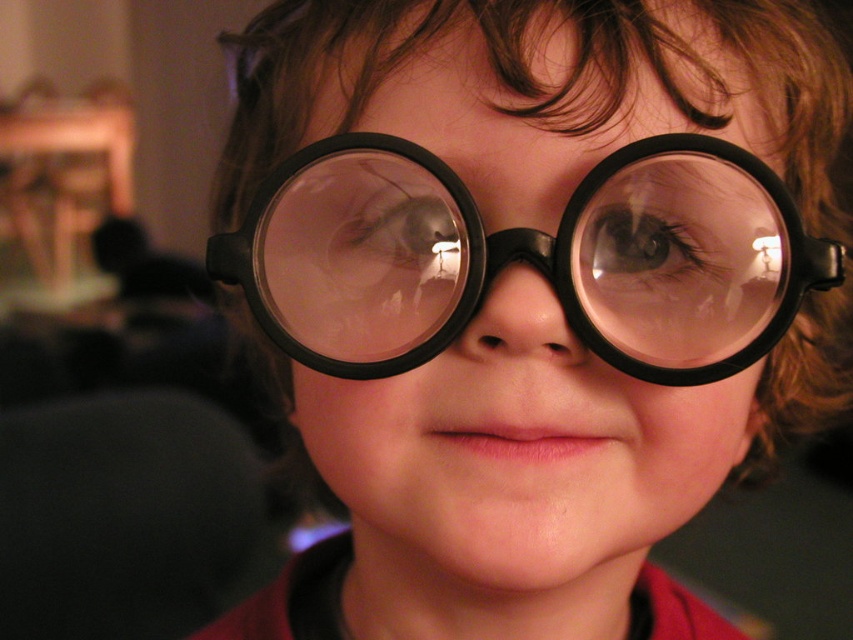
Question: Does black matte goggles at center appear on the right side of brown matte eye at center?

Choices:
 (A) yes
 (B) no

Answer: (B)

Question: Which of the following is the closest to the observer?

Choices:
 (A) [672, 211]
 (B) [335, 276]
 (C) [402, 259]

Answer: (C)

Question: In this image, where is black matte goggles at center located relative to brown matte eye at center?

Choices:
 (A) below
 (B) above

Answer: (A)

Question: Is black matte goggles at center smaller than translucent plastic eye at center?

Choices:
 (A) no
 (B) yes

Answer: (A)

Question: Which of the following is the farthest from the observer?

Choices:
 (A) (363, 266)
 (B) (589, 212)

Answer: (A)

Question: Which point appears farthest from the camera in this image?

Choices:
 (A) (657, 252)
 (B) (392, 241)
 (C) (622, 164)

Answer: (A)